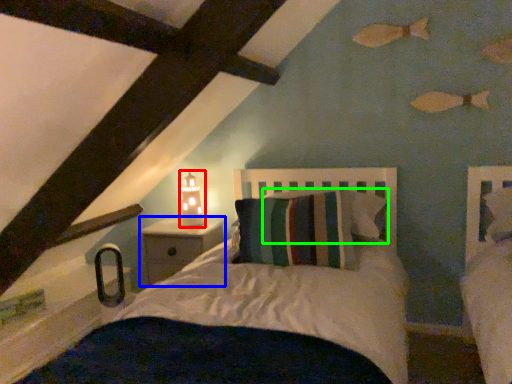
Question: Considering the real-world distances, which object is closest to table lamp (highlighted by a red box)? nightstand (highlighted by a blue box) or pillow (highlighted by a green box).

Choices:
 (A) nightstand
 (B) pillow

Answer: (A)